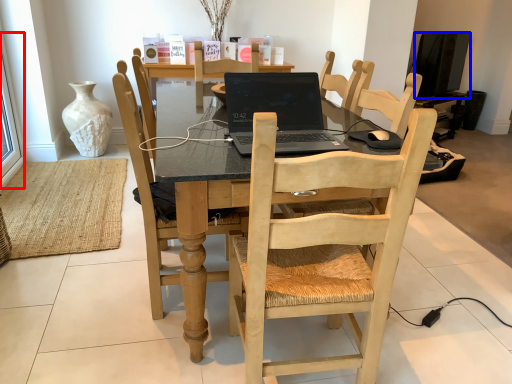
Question: Which object appears closest to the camera in this image, window screen (highlighted by a red box) or television (highlighted by a blue box)?

Choices:
 (A) window screen
 (B) television

Answer: (A)